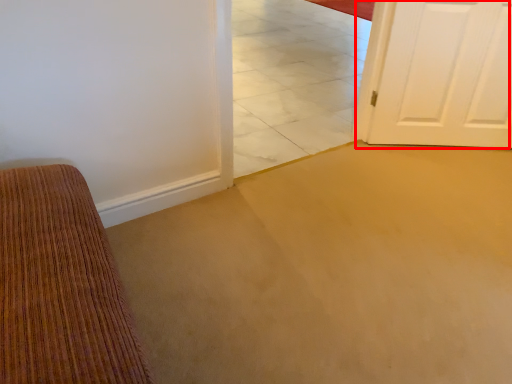
Question: From the image's perspective, considering the relative positions of door (annotated by the red box) and tile in the image provided, where is door (annotated by the red box) located with respect to the staircase?

Choices:
 (A) below
 (B) above

Answer: (B)